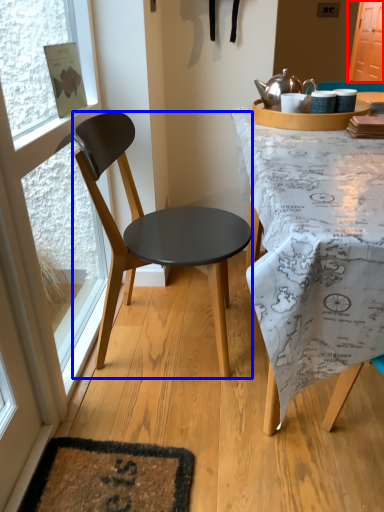
Question: Which point is further to the camera, screen door (highlighted by a red box) or chair (highlighted by a blue box)?

Choices:
 (A) screen door
 (B) chair

Answer: (A)